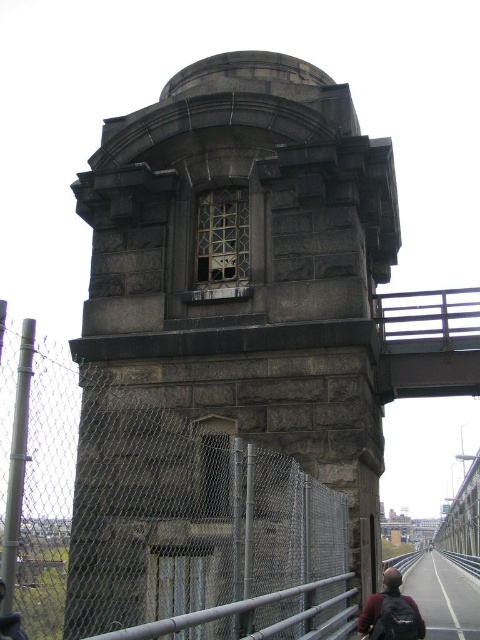
Question: Among these objects, which one is farthest from the camera?

Choices:
 (A) metal chain-link fence at center
 (B) metallic gray bridge at upper center

Answer: (B)

Question: Which point is closer to the camera taking this photo?

Choices:
 (A) (439, 365)
 (B) (285, 182)

Answer: (B)

Question: Does gray stone tower at center have a greater width compared to metal chain-link fence at center?

Choices:
 (A) yes
 (B) no

Answer: (A)

Question: Is metallic gray bridge at upper center to the right of dark brown backpack at lower right from the viewer's perspective?

Choices:
 (A) yes
 (B) no

Answer: (A)

Question: Is metallic gray bridge at upper center wider than dark brown backpack at lower right?

Choices:
 (A) no
 (B) yes

Answer: (B)

Question: Which point is farther to the camera?

Choices:
 (A) metallic gray bridge at upper center
 (B) gray stone tower at center
 (C) metal chain-link fence at center

Answer: (A)